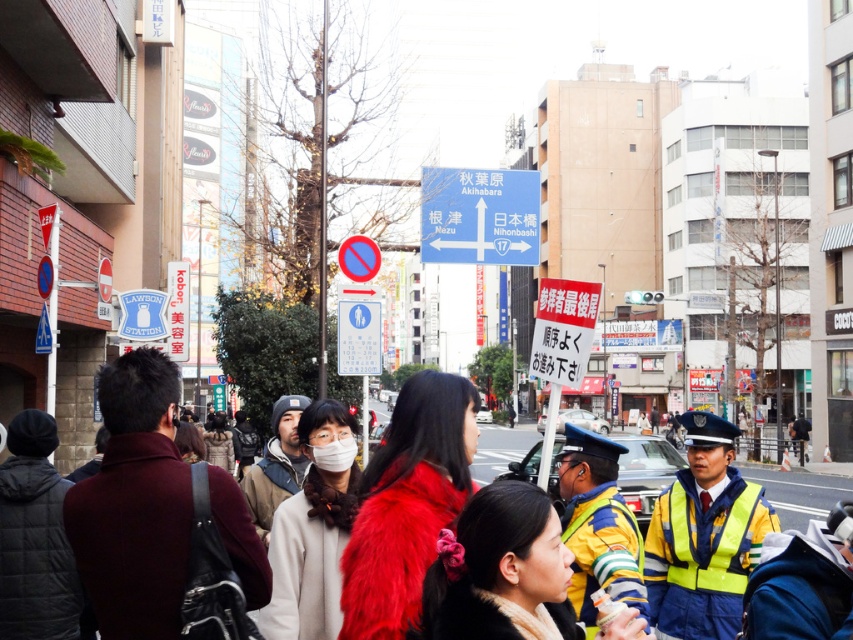
What are the coordinates of `blue plastic sign at upper center` in the screenshot? It's located at (479, 216).

Does blue plastic sign at upper center have a larger size compared to red fur coat at center?

Actually, blue plastic sign at upper center might be smaller than red fur coat at center.

The height and width of the screenshot is (640, 853). I want to click on blue plastic sign at upper center, so click(479, 216).

Which is below, maroon sweater at left or blue plastic sign at upper center?

Positioned lower is maroon sweater at left.

Does maroon sweater at left have a greater height compared to blue plastic sign at upper center?

Indeed, maroon sweater at left has a greater height compared to blue plastic sign at upper center.

Which is behind, point (71, 500) or point (518, 248)?

Positioned behind is point (518, 248).

At what (x,y) coordinates should I click in order to perform the action: click on maroon sweater at left. Please return your answer as a coordinate pair (x, y). The width and height of the screenshot is (853, 640). Looking at the image, I should click on tap(134, 504).

Does point (132, 625) lie behind point (833, 500)?

No.

Who is shorter, maroon sweater at left or red fur coat at center?

Standing shorter between the two is maroon sweater at left.

Find the location of a particular element. This screenshot has height=640, width=853. maroon sweater at left is located at coordinates (134, 504).